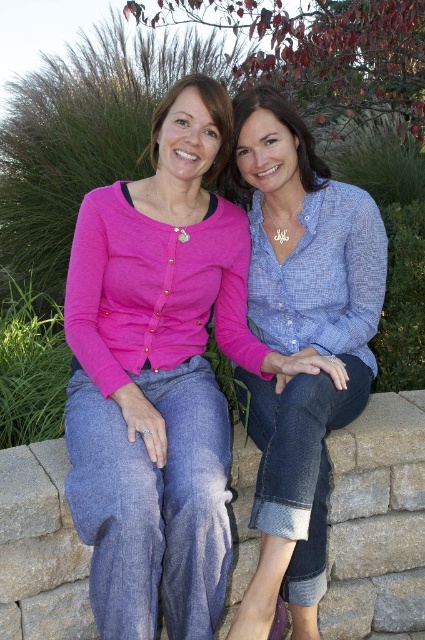
Looking at this image, you are a photographer setting up for a portrait. You notice two subjects wearing the matte pink sweater at center and the blue textured shirt at center. From the photographer s perspective, which clothing item is positioned to the left?

The matte pink sweater at center is positioned to the left of the blue textured shirt at center.

You are standing in front of the two women sitting on the stone wall. There is a point marked at coordinates (158, 376). Which object from the scene does this point lie on?

The point at coordinates (158, 376) lies on the matte pink sweater at center.

Where is the matte pink sweater at center located in the image?

The matte pink sweater at center is located at point (158, 376) in the image.